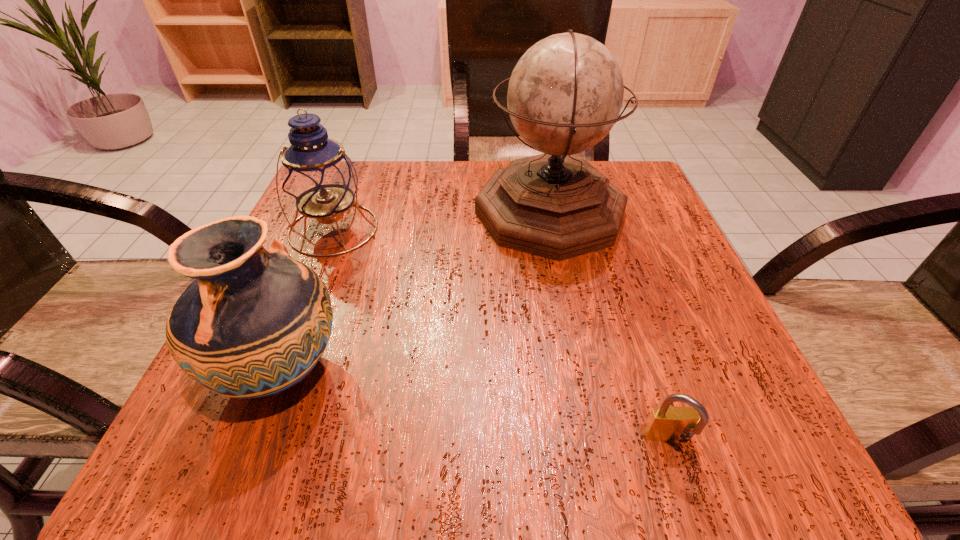
Where is `lantern located in the far edge section of the desktop`? lantern located in the far edge section of the desktop is located at coordinates (318, 177).

Find the location of `pottery situated at the near edge`. pottery situated at the near edge is located at coordinates (253, 323).

Image resolution: width=960 pixels, height=540 pixels. I want to click on padlock present at the near edge, so click(667, 424).

You are a GUI agent. You are given a task and a screenshot of the screen. Output one action in this format:
    pyautogui.click(x=<x>, y=<y>)
    Task: Click on the lantern present at the left edge
    
    Given the screenshot: What is the action you would take?
    pyautogui.click(x=318, y=177)

This screenshot has width=960, height=540. I want to click on pottery at the left edge, so click(253, 323).

Locate an element on the screen. The height and width of the screenshot is (540, 960). globe that is at the right edge is located at coordinates (565, 94).

Where is `padlock located in the right edge section of the desktop`? This screenshot has height=540, width=960. padlock located in the right edge section of the desktop is located at coordinates (667, 424).

Image resolution: width=960 pixels, height=540 pixels. Identify the location of object that is at the far left corner. (318, 177).

Identify the location of object that is at the near left corner. Image resolution: width=960 pixels, height=540 pixels. (253, 323).

Find the location of `object that is at the far right corner`. object that is at the far right corner is located at coordinates (565, 94).